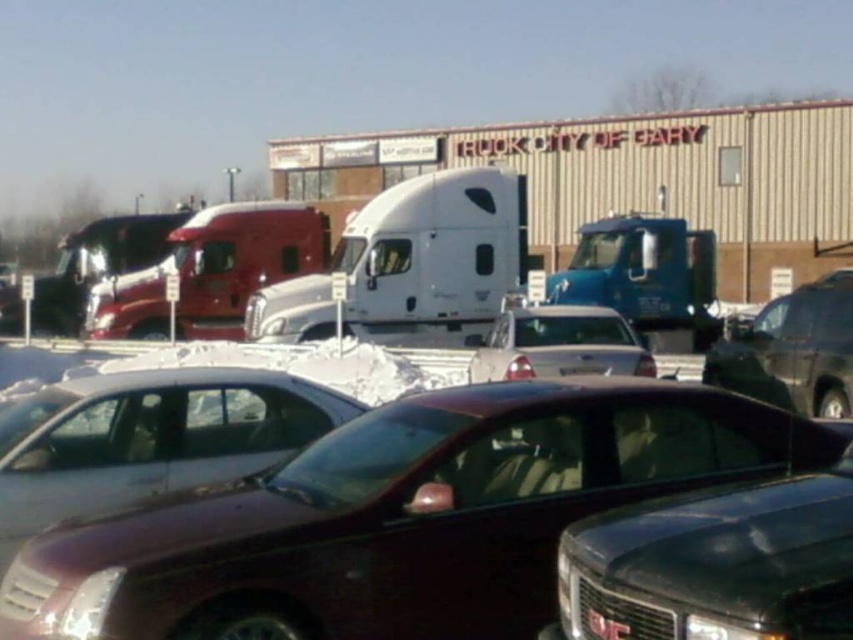
You are a delivery driver who needs to park your white glossy sedan at center in a space that can only accommodate vehicles smaller than the white glossy truck at center. Is your sedan suitable for that space?

The white glossy truck at center has a smaller size compared to white glossy sedan at center. Therefore, the sedan is larger than the truck, so it cannot fit into a space meant for vehicles smaller than the truck.